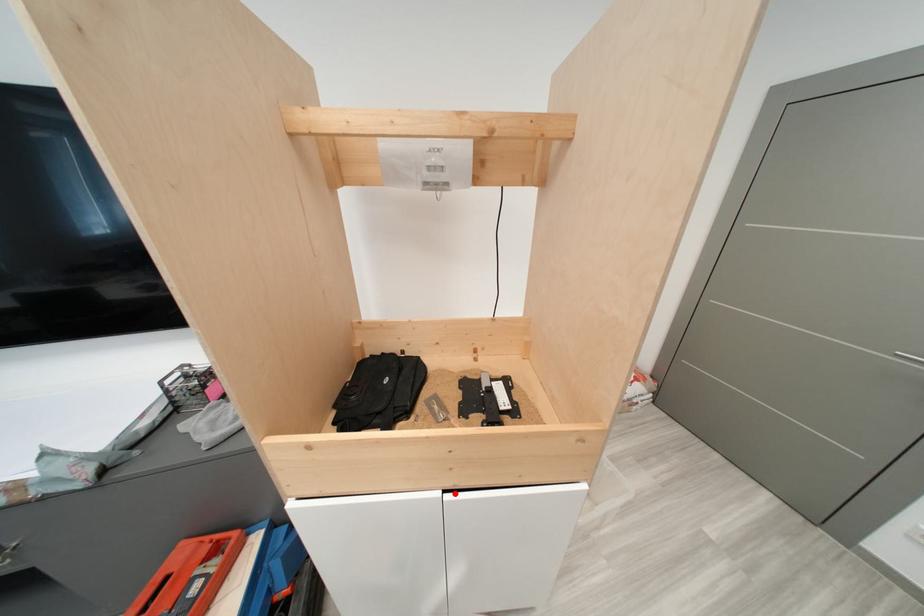
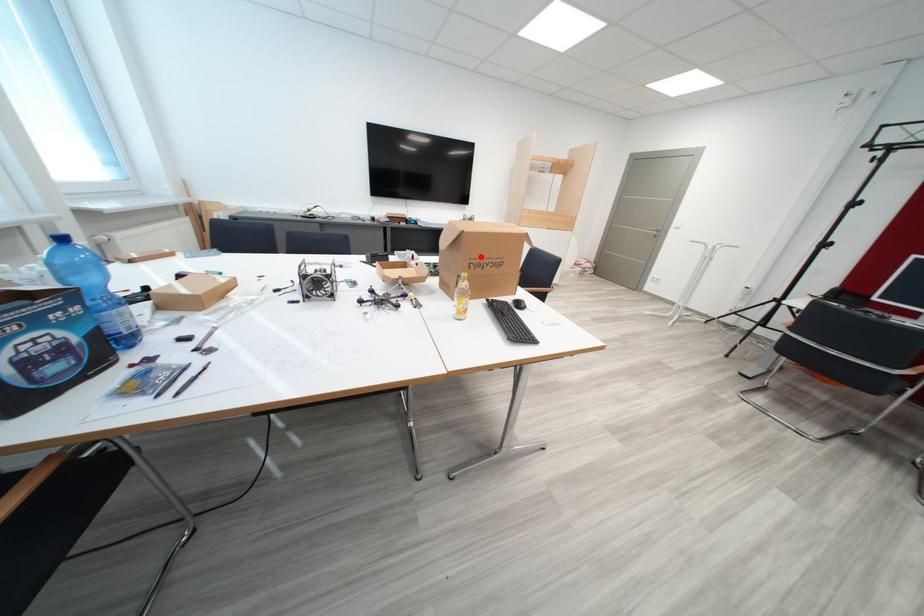
I am providing you with two images of the same scene from different viewpoints. A red point is marked on the first image and another point is marked on the second image. Does the point marked in image1 correspond to the same location as the one in image2?

No